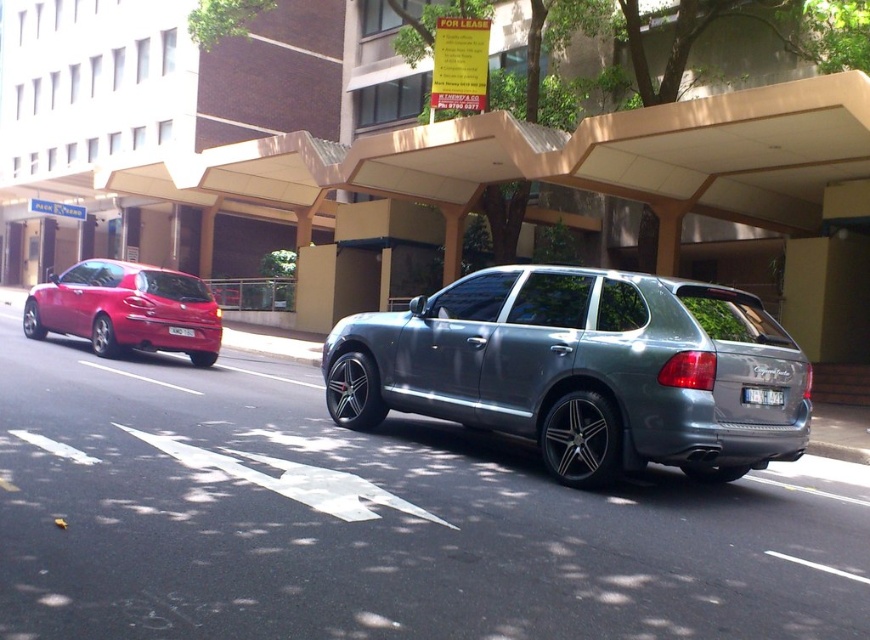
Question: Does metallic gray suv at center appear on the right side of white plastic license plate at center?

Choices:
 (A) no
 (B) yes

Answer: (B)

Question: Which point is closer to the camera?

Choices:
 (A) matte red hatchback at left
 (B) white plastic license plate at center

Answer: (A)

Question: Among these points, which one is nearest to the camera?

Choices:
 (A) (775, 388)
 (B) (182, 326)

Answer: (A)

Question: Is matte red hatchback at left above white plastic license plate at rear?

Choices:
 (A) no
 (B) yes

Answer: (B)

Question: Does metallic gray suv at center have a smaller size compared to white plastic license plate at center?

Choices:
 (A) yes
 (B) no

Answer: (B)

Question: Which object is closer to the camera taking this photo?

Choices:
 (A) matte red hatchback at left
 (B) white plastic license plate at center

Answer: (A)